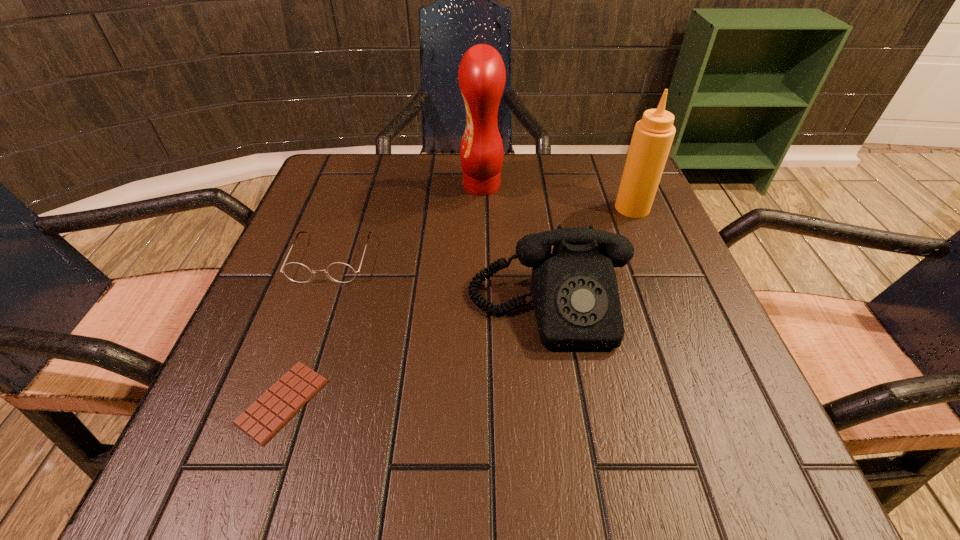
Where is `vacant point located between the telephone and the candy bar`? vacant point located between the telephone and the candy bar is located at coordinates (416, 355).

At what (x,y) coordinates should I click in order to perform the action: click on free point between the spectacles and the right condiment. Please return your answer as a coordinate pair (x, y). The height and width of the screenshot is (540, 960). Looking at the image, I should click on (482, 233).

Find the location of a particular element. free point between the second shortest object and the candy bar is located at coordinates (307, 330).

Locate which object is the third closest to the second shortest object. Please provide its 2D coordinates. Your answer should be formatted as a tuple, i.e. [(x, y)], where the tuple contains the x and y coordinates of a point satisfying the conditions above.

[(482, 75)]

Locate an element on the screen. This screenshot has width=960, height=540. object that stands as the closest to the rightmost object is located at coordinates (574, 290).

Locate an element on the screen. This screenshot has width=960, height=540. vacant region that satisfies the following two spatial constraints: 1. on the label side of the right condiment; 2. on the right side of the left condiment is located at coordinates (482, 208).

The width and height of the screenshot is (960, 540). Identify the location of free space that satisfies the following two spatial constraints: 1. on the label side of the left condiment; 2. on the right side of the right condiment. (482, 208).

At what (x,y) coordinates should I click in order to perform the action: click on blank area in the image that satisfies the following two spatial constraints: 1. on the label side of the left condiment; 2. on the front-facing side of the fourth tallest object. Please return your answer as a coordinate pair (x, y). Image resolution: width=960 pixels, height=540 pixels. Looking at the image, I should click on (482, 258).

In order to click on free point that satisfies the following two spatial constraints: 1. on the back side of the right condiment; 2. on the left side of the candy bar in this screenshot , I will do `click(350, 208)`.

You are a GUI agent. You are given a task and a screenshot of the screen. Output one action in this format:
    pyautogui.click(x=<x>, y=<y>)
    Task: Click on the vacant region that satisfies the following two spatial constraints: 1. on the label side of the left condiment; 2. on the front-facing side of the second shortest object
    
    Given the screenshot: What is the action you would take?
    (482, 258)